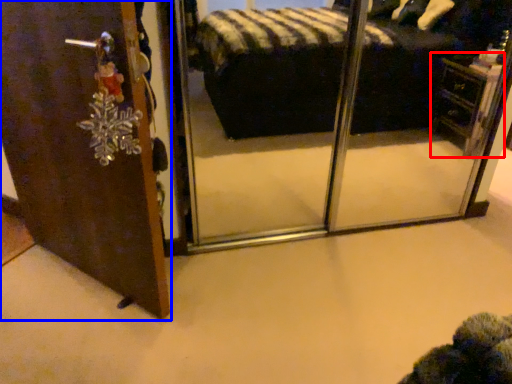
Question: Which object is further to the camera taking this photo, vanity (highlighted by a red box) or door (highlighted by a blue box)?

Choices:
 (A) vanity
 (B) door

Answer: (A)